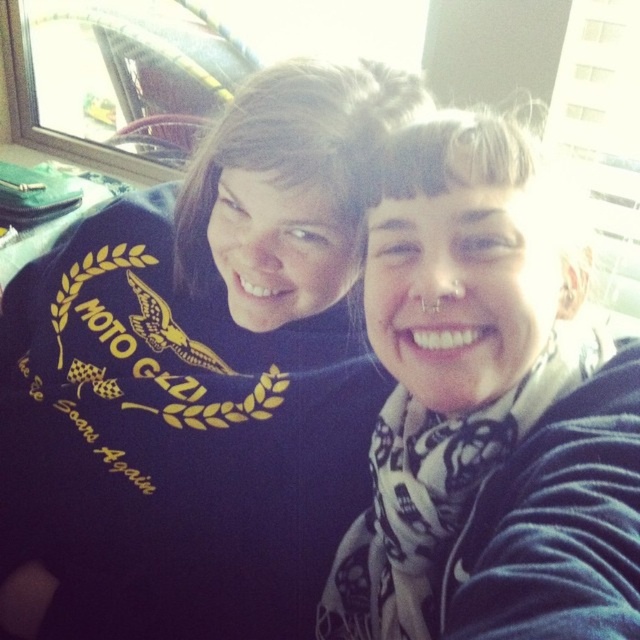
Question: Observing the image, what is the correct spatial positioning of dark blue sweatshirt at upper center in reference to white scarf at center?

Choices:
 (A) right
 (B) left

Answer: (B)

Question: Where is dark blue sweatshirt at upper center located in relation to white scarf at center in the image?

Choices:
 (A) below
 (B) above

Answer: (B)

Question: Which of the following is the closest to the observer?

Choices:
 (A) dark blue sweatshirt at upper center
 (B) white scarf at center

Answer: (B)

Question: Can you confirm if dark blue sweatshirt at upper center is positioned to the left of white scarf at center?

Choices:
 (A) no
 (B) yes

Answer: (B)

Question: Which point is closer to the camera?

Choices:
 (A) (368, 321)
 (B) (29, 282)

Answer: (A)